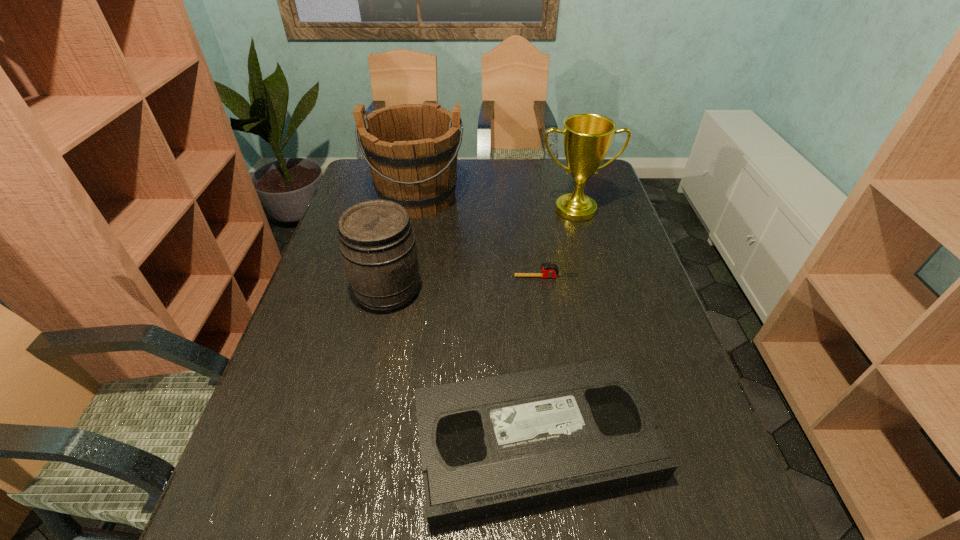
Where is `blank space located 0.260m on the back of the videotape`? blank space located 0.260m on the back of the videotape is located at coordinates (520, 291).

Locate an element on the screen. The image size is (960, 540). vacant space located 0.250m on the front of the shortest object is located at coordinates (559, 352).

The width and height of the screenshot is (960, 540). Find the location of `object that is at the far edge`. object that is at the far edge is located at coordinates (411, 149).

Where is `award situated at the right edge`? award situated at the right edge is located at coordinates (587, 138).

Where is `videotape that is at the right edge`? This screenshot has height=540, width=960. videotape that is at the right edge is located at coordinates (491, 446).

At what (x,y) coordinates should I click in order to perform the action: click on object that is at the far left corner. Please return your answer as a coordinate pair (x, y). Looking at the image, I should click on (411, 149).

This screenshot has width=960, height=540. In the image, there is a desktop. In order to click on blank space at the far edge in this screenshot , I will do `click(463, 180)`.

The width and height of the screenshot is (960, 540). In the image, there is a desktop. What are the coordinates of `vacant area at the left edge` in the screenshot? It's located at (324, 366).

Find the location of a particular element. free region at the right edge of the desktop is located at coordinates (606, 215).

The width and height of the screenshot is (960, 540). In the image, there is a desktop. What are the coordinates of `vacant area at the far left corner` in the screenshot? It's located at (357, 181).